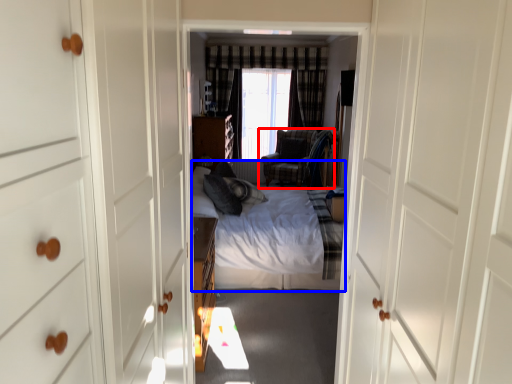
Question: Which object is further to the camera taking this photo, chair (highlighted by a red box) or bed (highlighted by a blue box)?

Choices:
 (A) chair
 (B) bed

Answer: (A)